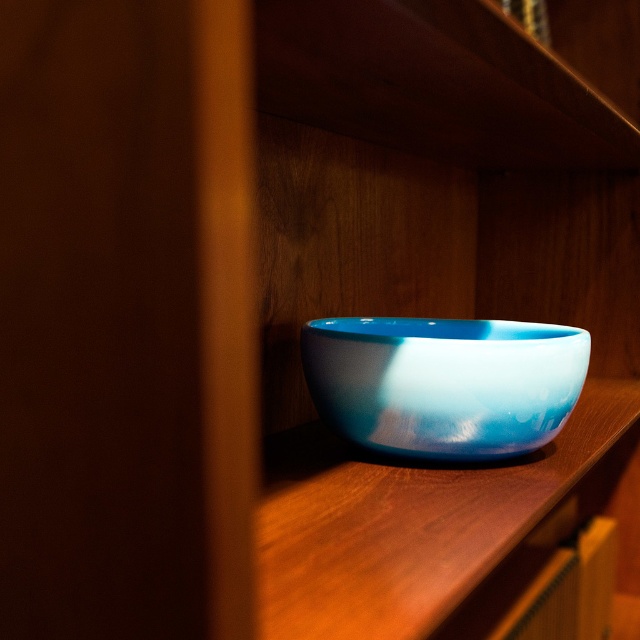
Is blue glossy bowl at center closer to the viewer compared to glossy ceramic bowl at center?

Yes, it is.

Between point (596, 452) and point (504, 397), which one is positioned in front?

Point (504, 397) is more forward.

This screenshot has width=640, height=640. What do you see at coordinates (424, 284) in the screenshot?
I see `blue glossy bowl at center` at bounding box center [424, 284].

At what (x,y) coordinates should I click in order to perform the action: click on blue glossy bowl at center. Please return your answer as a coordinate pair (x, y). The height and width of the screenshot is (640, 640). Looking at the image, I should click on (424, 284).